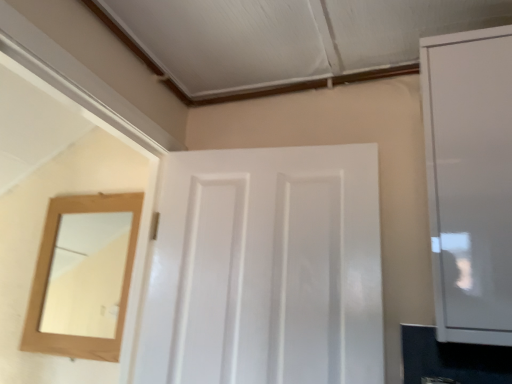
Question: From a real-world perspective, is white glossy cabinet at right physically above white glossy door at center?

Choices:
 (A) yes
 (B) no

Answer: (A)

Question: Considering the relative sizes of white glossy cabinet at right and white glossy door at center in the image provided, is white glossy cabinet at right taller than white glossy door at center?

Choices:
 (A) no
 (B) yes

Answer: (B)

Question: Does white glossy cabinet at right come in front of white glossy door at center?

Choices:
 (A) yes
 (B) no

Answer: (A)

Question: Is white glossy cabinet at right facing towards white glossy door at center?

Choices:
 (A) yes
 (B) no

Answer: (B)

Question: Considering the relative sizes of white glossy cabinet at right and white glossy door at center in the image provided, is white glossy cabinet at right smaller than white glossy door at center?

Choices:
 (A) yes
 (B) no

Answer: (A)

Question: Does white glossy cabinet at right lie behind white glossy door at center?

Choices:
 (A) yes
 (B) no

Answer: (B)

Question: Is white glossy door at center positioned with its back to white glossy cabinet at right?

Choices:
 (A) no
 (B) yes

Answer: (A)

Question: From the image's perspective, is white glossy door at center located above white glossy cabinet at right?

Choices:
 (A) no
 (B) yes

Answer: (A)

Question: Is white glossy door at center next to white glossy cabinet at right and touching it?

Choices:
 (A) no
 (B) yes

Answer: (A)

Question: Is white glossy door at center far away from white glossy cabinet at right?

Choices:
 (A) yes
 (B) no

Answer: (B)

Question: From a real-world perspective, is white glossy door at center on white glossy cabinet at right?

Choices:
 (A) no
 (B) yes

Answer: (A)

Question: From the image's perspective, is white glossy door at center beneath white glossy cabinet at right?

Choices:
 (A) yes
 (B) no

Answer: (A)

Question: Looking at their shapes, would you say white glossy cabinet at right is wider or thinner than white glossy door at center?

Choices:
 (A) thin
 (B) wide

Answer: (A)